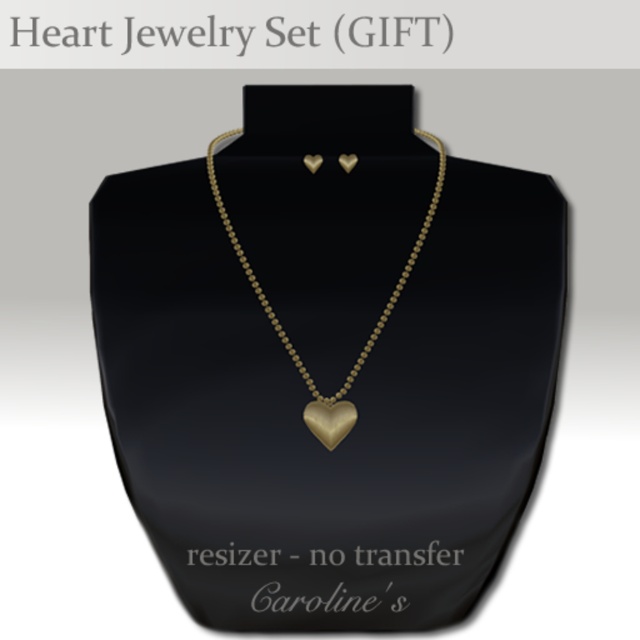
You are a customer looking at the jewelry display. You see two points marked in the image. Which point is closer to you, point (212, 141) or point (317, 436)?

Point (212, 141) is in front of point (317, 436), so it is closer to you.